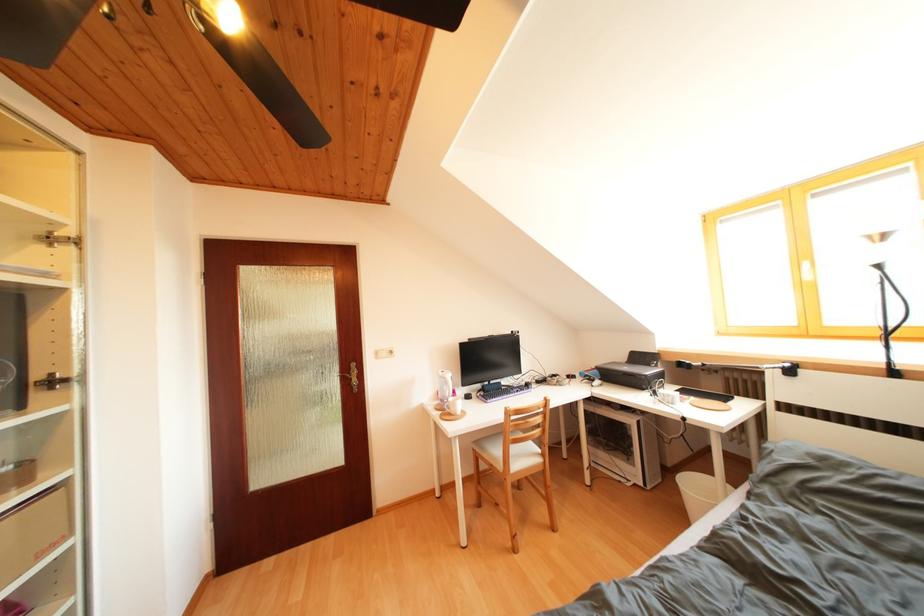
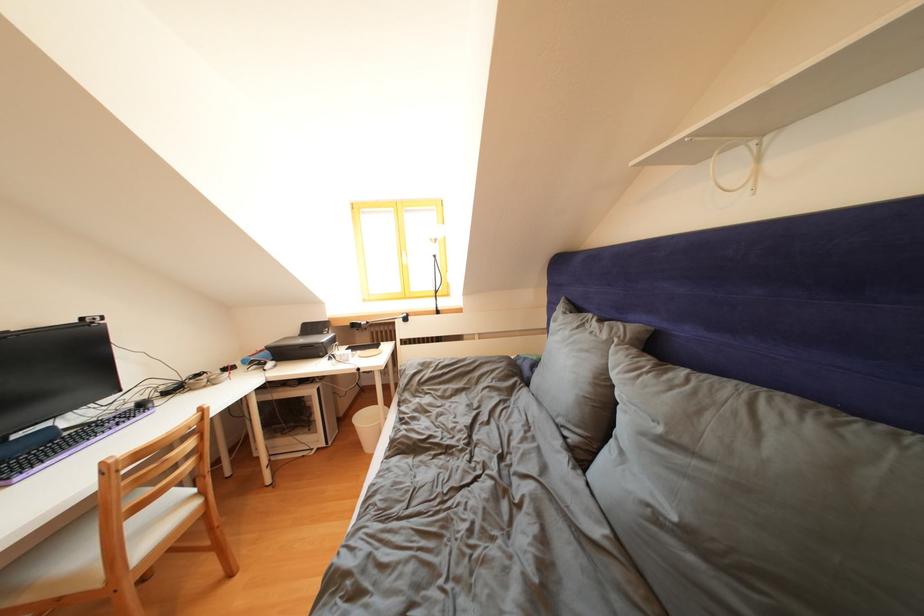
In the second image, find the point that corresponds to (533,462) in the first image.

(175, 522)